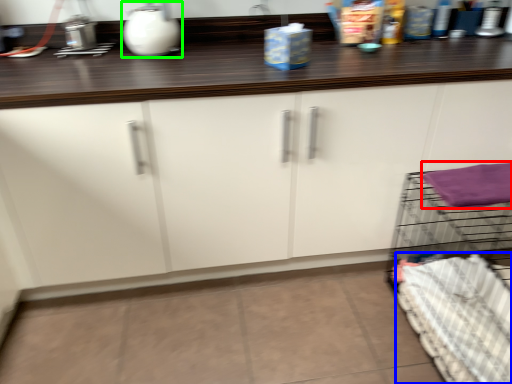
Question: Considering the real-world distances, which object is closest to bath towel (highlighted by a red box)? bedding (highlighted by a blue box) or appliance (highlighted by a green box).

Choices:
 (A) bedding
 (B) appliance

Answer: (A)